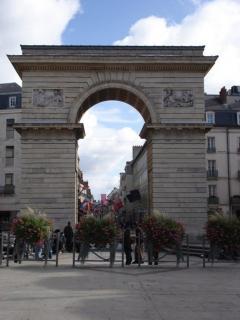
In order to click on windows in this screenshot , I will do `click(212, 138)`, `click(212, 118)`, `click(14, 103)`, `click(10, 150)`, `click(10, 176)`, `click(213, 191)`, `click(214, 167)`.